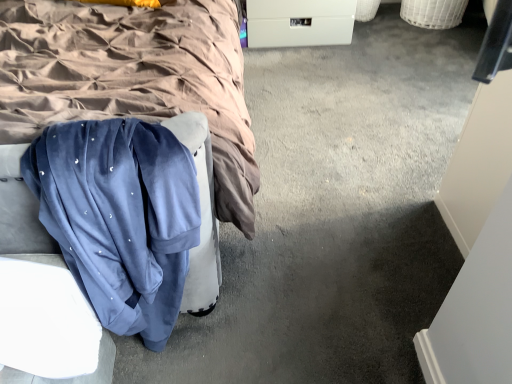
Identify the location of free location to the right of velvet blue sweatpants at lower left. This screenshot has height=384, width=512. (262, 315).